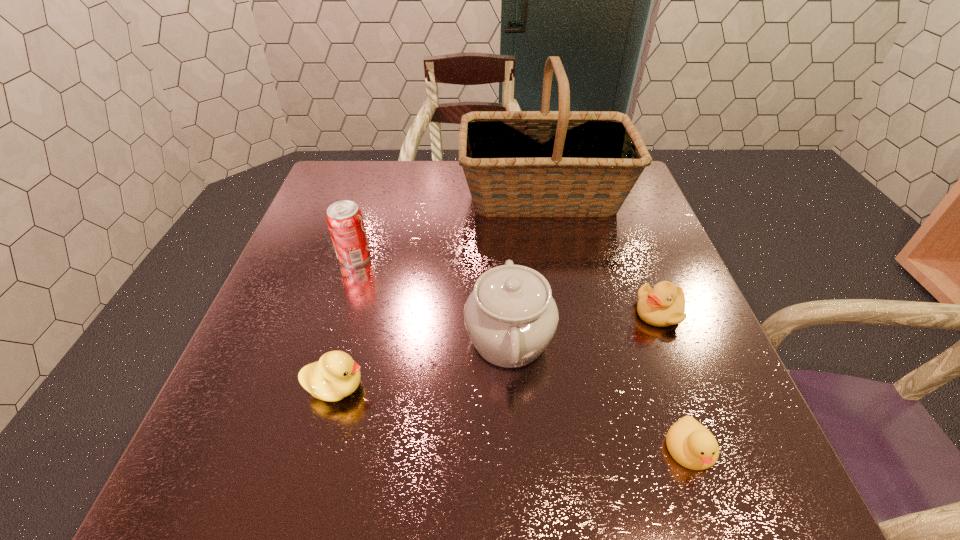
Identify the location of the farthest object. [563, 163].

Identify the location of basket. (563, 163).

In order to click on chinaware in this screenshot , I will do `click(510, 316)`.

Locate an element on the screen. the second farthest object is located at coordinates (345, 221).

This screenshot has width=960, height=540. What are the coordinates of `soda can` in the screenshot? It's located at (345, 221).

Locate an element on the screen. The height and width of the screenshot is (540, 960). the second nearest duckling is located at coordinates (335, 376).

The image size is (960, 540). Find the location of `the farthest duckling`. the farthest duckling is located at coordinates (663, 305).

What are the coordinates of `the shortest duckling` in the screenshot? It's located at (692, 445).

The image size is (960, 540). In order to click on the nearest duckling in this screenshot , I will do `click(692, 445)`.

Identify the location of free space located by the handle of the farthest object. The image size is (960, 540). (396, 195).